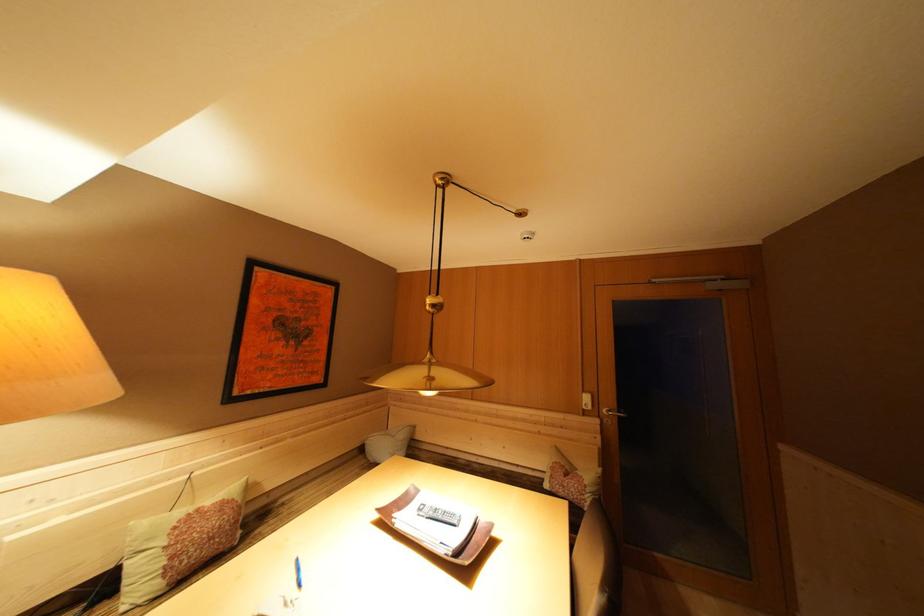
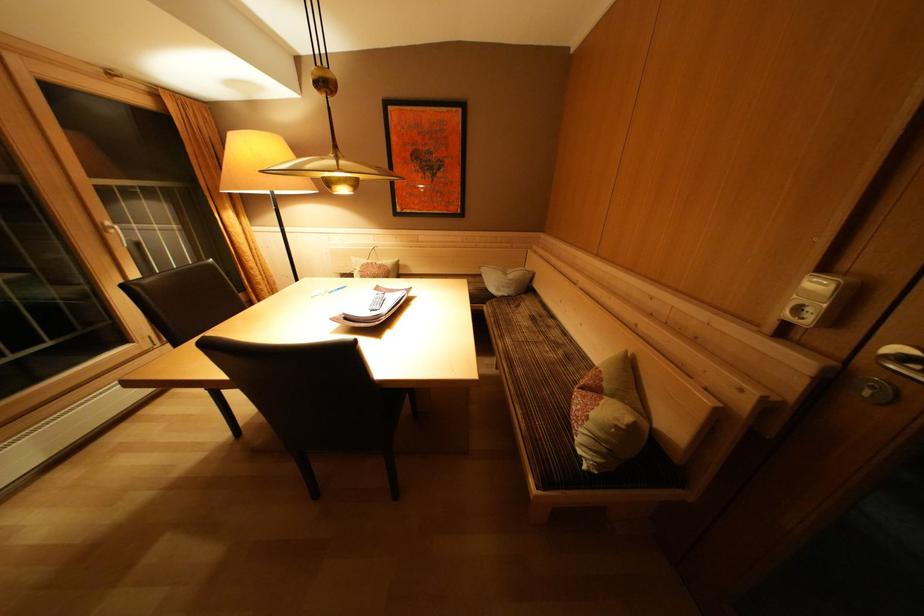
Find the pixel in the second image that matches point 204,515 in the first image.

(379, 268)